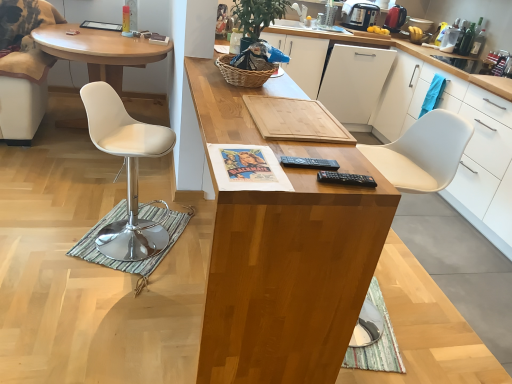
In order to click on free space in front of woven brown picnic basket at center in this screenshot , I will do `click(237, 93)`.